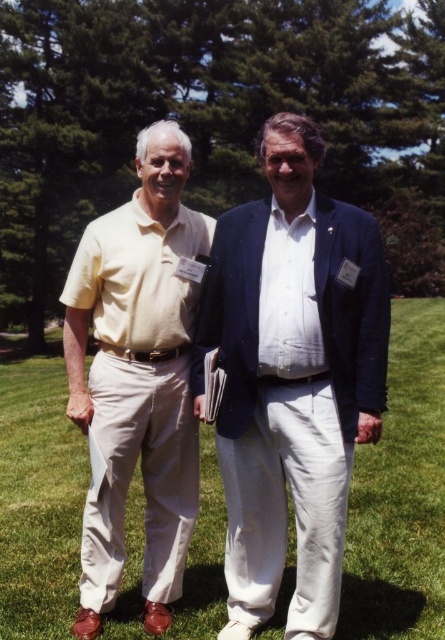
Who is higher up, matte yellow shirt at center or matte yellow shirt at left?

matte yellow shirt at left is higher up.

You are a GUI agent. You are given a task and a screenshot of the screen. Output one action in this format:
    pyautogui.click(x=<x>, y=<y>)
    Task: Click on the matte yellow shirt at center
    
    Given the screenshot: What is the action you would take?
    pyautogui.click(x=291, y=378)

Is point (250, 618) positioned behind point (156, 525)?

No, it is in front of (156, 525).

The height and width of the screenshot is (640, 445). I want to click on matte yellow shirt at center, so click(x=291, y=378).